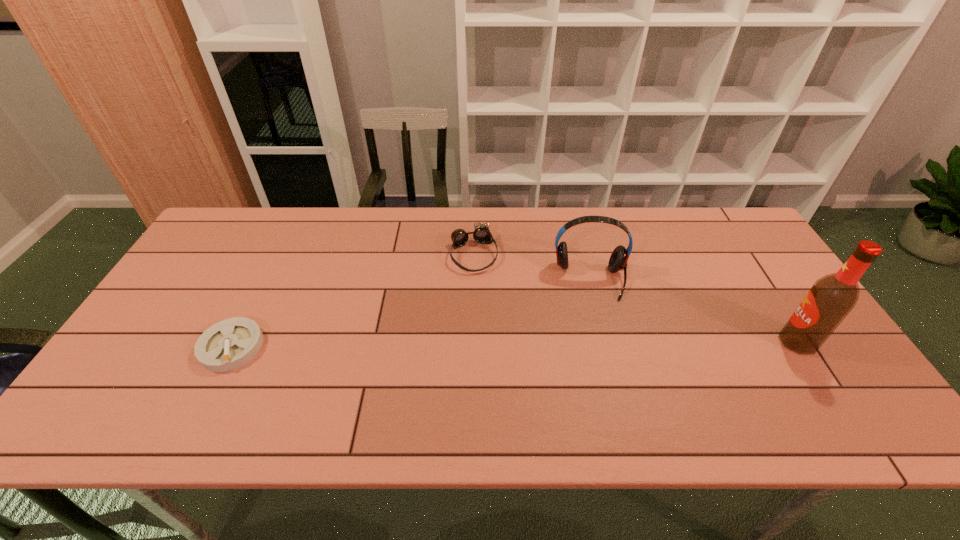
Find the location of a particular element. Image resolution: width=960 pixels, height=540 pixels. vacant space that's between the second object from left to right and the headset is located at coordinates (532, 267).

Identify the location of free area in between the shortest object and the second shortest object. Image resolution: width=960 pixels, height=540 pixels. (353, 300).

Where is `vacant space that's between the leftmost object and the headset`? This screenshot has height=540, width=960. vacant space that's between the leftmost object and the headset is located at coordinates (411, 313).

I want to click on vacant area that lies between the goggles and the third shortest object, so click(532, 267).

Identify the location of object that is the third closest to the third shortest object. (229, 344).

Identify which object is the second closest to the third object from left to right. Please provide its 2D coordinates. Your answer should be formatted as a tuple, i.e. [(x, y)], where the tuple contains the x and y coordinates of a point satisfying the conditions above.

[(832, 297)]

I want to click on vacant space that satisfies the following two spatial constraints: 1. on the back side of the headset; 2. on the right side of the ashtray, so click(266, 280).

Find the location of a particular element. The height and width of the screenshot is (540, 960). free space that satisfies the following two spatial constraints: 1. on the back side of the second object from left to right; 2. on the left side of the ashtray is located at coordinates (278, 254).

Find the location of a particular element. The width and height of the screenshot is (960, 540). vacant space that satisfies the following two spatial constraints: 1. on the back side of the shortest object; 2. on the left side of the goggles is located at coordinates (278, 254).

At what (x,y) coordinates should I click in order to perform the action: click on vacant space that satisfies the following two spatial constraints: 1. on the front side of the beer bottle; 2. on the right side of the second object from left to right. Please return your answer as a coordinate pair (x, y). The image size is (960, 540). Looking at the image, I should click on (472, 341).